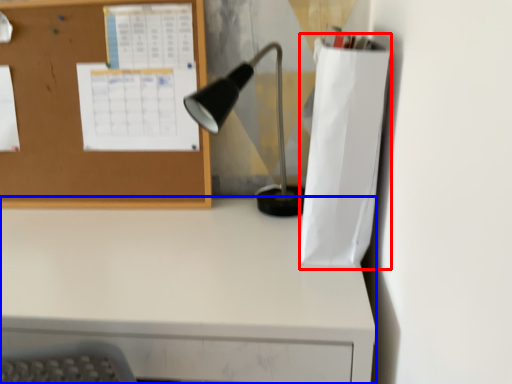
Question: Which point is closer to the camera, paper bag (highlighted by a red box) or desk (highlighted by a blue box)?

Choices:
 (A) paper bag
 (B) desk

Answer: (B)